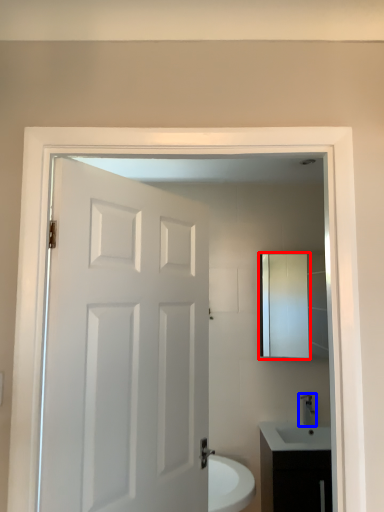
Question: Among these objects, which one is farthest to the camera, medicine cabinet (highlighted by a red box) or tap (highlighted by a blue box)?

Choices:
 (A) medicine cabinet
 (B) tap

Answer: (A)